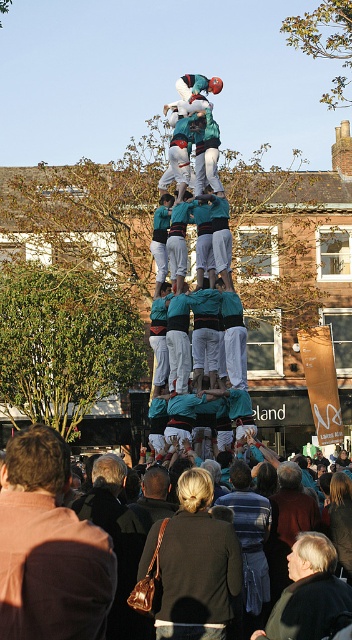
Question: Can you confirm if brown leather jacket at lower left is positioned below dark blue jacket at center?

Choices:
 (A) yes
 (B) no

Answer: (B)

Question: Is dark brown leather jacket at lower center to the right of brown leather bag at lower center from the viewer's perspective?

Choices:
 (A) yes
 (B) no

Answer: (B)

Question: Which of the following is the closest to the observer?

Choices:
 (A) (21, 452)
 (B) (260, 531)
 (C) (303, 541)

Answer: (A)

Question: Which object is positioned farthest from the dark blue jacket at center?

Choices:
 (A) brown leather bag at lower center
 (B) brown leather jacket at lower left

Answer: (B)

Question: Which of the following is the closest to the observer?

Choices:
 (A) dark gray jacket at center
 (B) brown leather bag at lower center

Answer: (A)

Question: From the image, what is the correct spatial relationship of brown leather jacket at lower left in relation to dark gray jacket at center?

Choices:
 (A) right
 (B) left

Answer: (B)